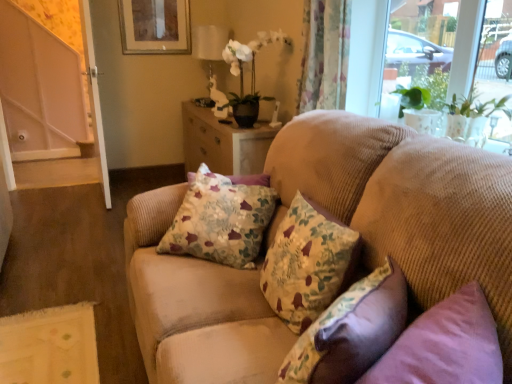
Question: Do you think floral fabric cushion at center, which is the third pillow from front to back, is within white glossy door at left, which ranks as the 1th screen door in right-to-left order, or outside of it?

Choices:
 (A) inside
 (B) outside

Answer: (B)

Question: Is point (168, 233) closer or farther from the camera than point (87, 23)?

Choices:
 (A) farther
 (B) closer

Answer: (B)

Question: Which object is the farthest from the white glossy orchid at upper center?

Choices:
 (A) white glossy lampshade at upper center
 (B) beige corduroy couch at center
 (C) floral fabric cushion at center, which is the third pillow from front to back
 (D) white glossy door at left, which ranks as the 1th screen door in right-to-left order
 (E) white glossy screen door at left, which is counted as the second screen door, starting from the right

Answer: (E)

Question: Estimate the real-world distances between objects in this image. Which object is closer to the white glossy lampshade at upper center?

Choices:
 (A) white glossy screen door at left, which is counted as the second screen door, starting from the right
 (B) white glossy door at left, which ranks as the 1th screen door in right-to-left order
 (C) floral fabric pillow at center, the 2th pillow viewed from the back
 (D) matte wooden picture frame at upper center
 (E) floral fabric pillow at center, which is the 1th pillow in front-to-back order

Answer: (D)